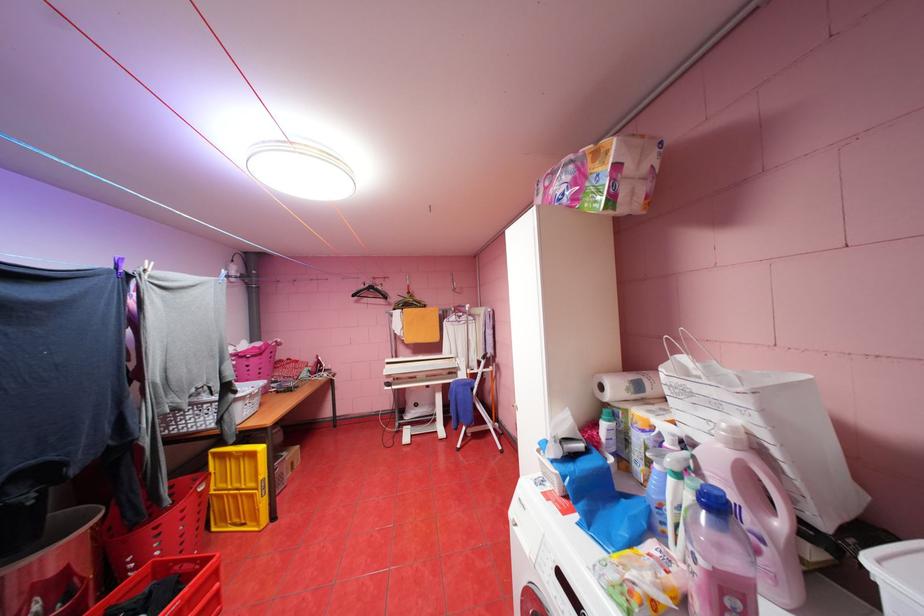
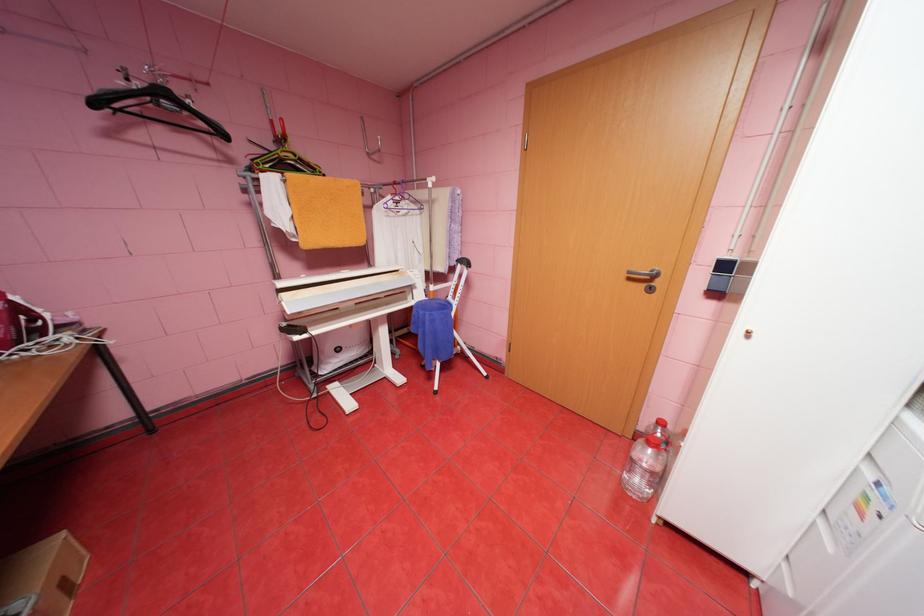
Locate, in the second image, the point that corresponds to pixel 327 362 in the first image.

(26, 309)